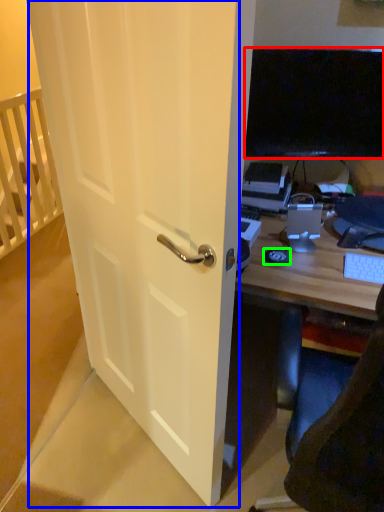
Question: Which object is positioned farthest from television (highlighted by a red box)? Select from screen door (highlighted by a blue box) and mousepad (highlighted by a green box).

Choices:
 (A) screen door
 (B) mousepad

Answer: (A)